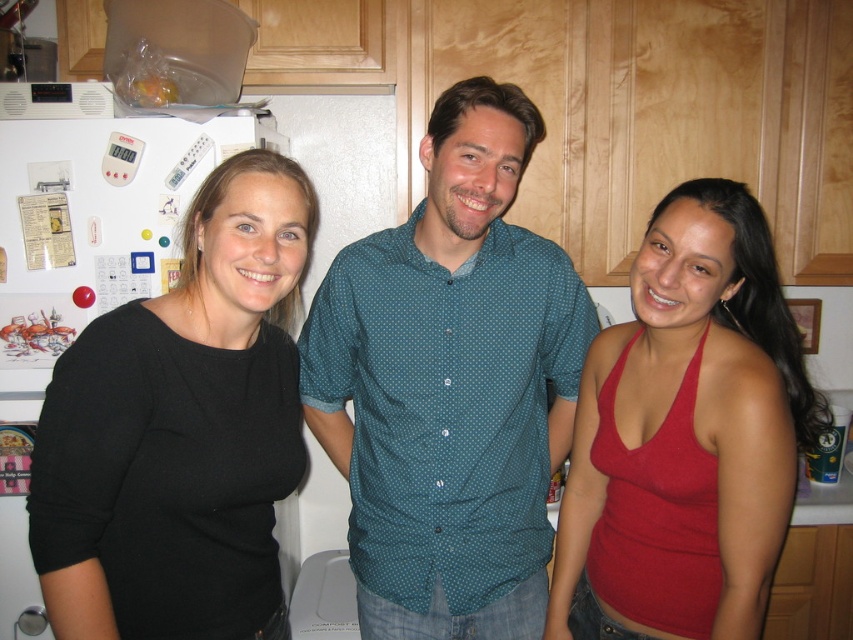
You are a photographer trying to capture a group shot of the black matte shirt at left and the matte red tank top at center. Since you want to ensure both are visible in the frame, which direction should you position the camera relative to their current positions?

The black matte shirt at left is positioned on the left side of matte red tank top at center, so you should position the camera to the right side of the group to ensure both are visible in the frame.